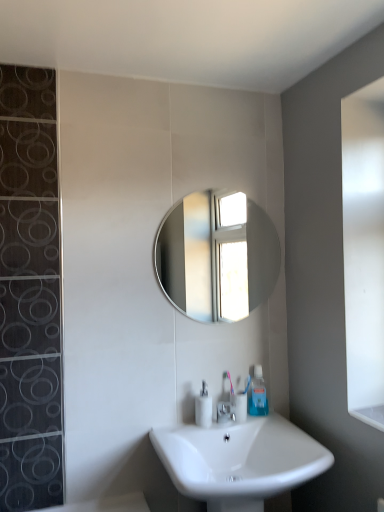
This screenshot has height=512, width=384. Describe the element at coordinates (225, 412) in the screenshot. I see `silver metallic faucet at center` at that location.

I want to click on white glossy soap dispenser at center, so click(x=203, y=407).

Considering the sizes of objects white glossy sink at lower center and shiny silver mirror at center in the image provided, who is smaller, white glossy sink at lower center or shiny silver mirror at center?

Smaller between the two is shiny silver mirror at center.

Is shiny silver mirror at center surrounded by white glossy sink at lower center?

No.

Which is less distant, (231, 429) or (207, 308)?

Positioned in front is point (231, 429).

Can you confirm if white glossy sink at lower center is shorter than shiny silver mirror at center?

Yes.

Are silver metallic faucet at center and white glossy soap dispenser at center making contact?

No, silver metallic faucet at center is not touching white glossy soap dispenser at center.

Considering the relative sizes of silver metallic faucet at center and white glossy soap dispenser at center in the image provided, is silver metallic faucet at center smaller than white glossy soap dispenser at center?

Indeed, silver metallic faucet at center has a smaller size compared to white glossy soap dispenser at center.

From the image's perspective, does white glossy soap dispenser at center appear lower than silver metallic faucet at center?

No, from the image's perspective, white glossy soap dispenser at center is not beneath silver metallic faucet at center.

Where is `soap dispenser located above the silver metallic faucet at center (from a real-world perspective)`? soap dispenser located above the silver metallic faucet at center (from a real-world perspective) is located at coordinates (203, 407).

Is point (208, 400) closer or farther from the camera than point (220, 414)?

Point (208, 400) is positioned closer to the camera compared to point (220, 414).

Based on the photo, is white glossy soap dispenser at center touching silver metallic faucet at center?

No, white glossy soap dispenser at center is not touching silver metallic faucet at center.

From the image's perspective, which is below, white glossy soap dispenser at center or white glossy sink at lower center?

white glossy sink at lower center appears lower in the image.

Which is farther from the camera, (203, 397) or (181, 468)?

The point (203, 397) is more distant.

Can you confirm if white glossy soap dispenser at center is shorter than white glossy sink at lower center?

Indeed, white glossy soap dispenser at center has a lesser height compared to white glossy sink at lower center.

Is silver metallic faucet at center to the left of white glossy sink at lower center from the viewer's perspective?

Indeed, silver metallic faucet at center is positioned on the left side of white glossy sink at lower center.

Based on the photo, which point is more distant from viewer, (234,412) or (206,484)?

Point (234,412)

Based on the photo, would you consider silver metallic faucet at center to be distant from white glossy sink at lower center?

silver metallic faucet at center is near white glossy sink at lower center, not far away.

From the image's perspective, which is above, silver metallic faucet at center or white glossy sink at lower center?

silver metallic faucet at center.

In terms of height, does white glossy soap dispenser at center look taller or shorter compared to shiny silver mirror at center?

Considering their sizes, white glossy soap dispenser at center has less height than shiny silver mirror at center.

Is white glossy soap dispenser at center facing towards shiny silver mirror at center?

No, white glossy soap dispenser at center does not turn towards shiny silver mirror at center.

At what (x,y) coordinates should I click in order to perform the action: click on mirror above the white glossy soap dispenser at center (from the image's perspective). Please return your answer as a coordinate pair (x, y). The image size is (384, 512). Looking at the image, I should click on (216, 256).

Does white glossy soap dispenser at center come behind shiny silver mirror at center?

No, the depth of white glossy soap dispenser at center is less than that of shiny silver mirror at center.

From the image's perspective, which is above, clear plastic toothpaste tube at lower center or shiny silver mirror at center?

shiny silver mirror at center is shown above in the image.

What are the coordinates of `mirror located above the clear plastic toothpaste tube at lower center (from a real-world perspective)` in the screenshot? It's located at (216, 256).

Is clear plastic toothpaste tube at lower center at the left side of shiny silver mirror at center?

No, clear plastic toothpaste tube at lower center is not to the left of shiny silver mirror at center.

Can you confirm if clear plastic toothpaste tube at lower center is bigger than shiny silver mirror at center?

Actually, clear plastic toothpaste tube at lower center might be smaller than shiny silver mirror at center.

This screenshot has width=384, height=512. Find the location of `sink located below the shiny silver mirror at center (from the image's perspective)`. sink located below the shiny silver mirror at center (from the image's perspective) is located at coordinates (239, 461).

Where is `tap below the white glossy soap dispenser at center (from a real-world perspective)`? The width and height of the screenshot is (384, 512). tap below the white glossy soap dispenser at center (from a real-world perspective) is located at coordinates (225, 412).

Estimate the real-world distances between objects in this image. Which object is further from shiny silver mirror at center, white glossy soap dispenser at center or clear plastic toothpaste tube at lower center?

white glossy soap dispenser at center.

From the image, which object appears to be farther from clear plastic toothpaste tube at lower center, white glossy sink at lower center or white glossy soap dispenser at center?

white glossy sink at lower center lies further to clear plastic toothpaste tube at lower center than the other object.

When comparing their distances from silver metallic faucet at center, does shiny silver mirror at center or clear plastic toothpaste tube at lower center seem closer?

clear plastic toothpaste tube at lower center is closer to silver metallic faucet at center.

Considering their positions, is white glossy sink at lower center positioned further to shiny silver mirror at center than silver metallic faucet at center?

The object further to shiny silver mirror at center is silver metallic faucet at center.

Based on their spatial positions, is white glossy soap dispenser at center or shiny silver mirror at center further from silver metallic faucet at center?

shiny silver mirror at center.

Which object lies further to the anchor point white glossy soap dispenser at center, white glossy sink at lower center or silver metallic faucet at center?

white glossy sink at lower center.

From the image, which object appears to be nearer to clear plastic toothpaste tube at lower center, silver metallic faucet at center or white glossy sink at lower center?

silver metallic faucet at center.

Based on their spatial positions, is silver metallic faucet at center or white glossy soap dispenser at center closer to white glossy sink at lower center?

The object closer to white glossy sink at lower center is white glossy soap dispenser at center.

The height and width of the screenshot is (512, 384). Identify the location of toiletry that lies between shiny silver mirror at center and white glossy soap dispenser at center from top to bottom. (258, 394).

Image resolution: width=384 pixels, height=512 pixels. In order to click on toiletry between shiny silver mirror at center and white glossy sink at lower center from top to bottom in this screenshot , I will do `click(258, 394)`.

The image size is (384, 512). Identify the location of tap located between white glossy soap dispenser at center and clear plastic toothpaste tube at lower center in the left-right direction. (225, 412).

Find the location of a particular element. tap between white glossy sink at lower center and white glossy soap dispenser at center in the front-back direction is located at coordinates (225, 412).